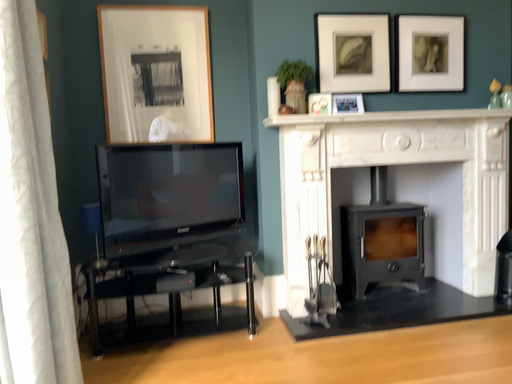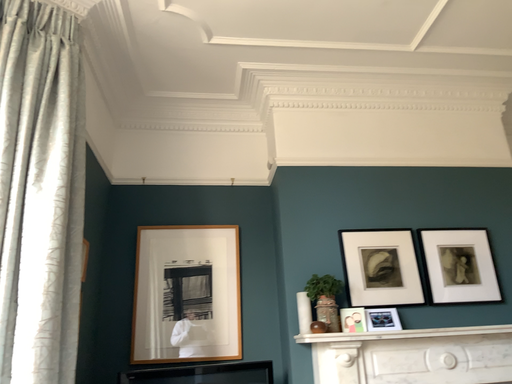
Question: How did the camera likely rotate when shooting the video?

Choices:
 (A) rotated upward
 (B) rotated downward

Answer: (A)